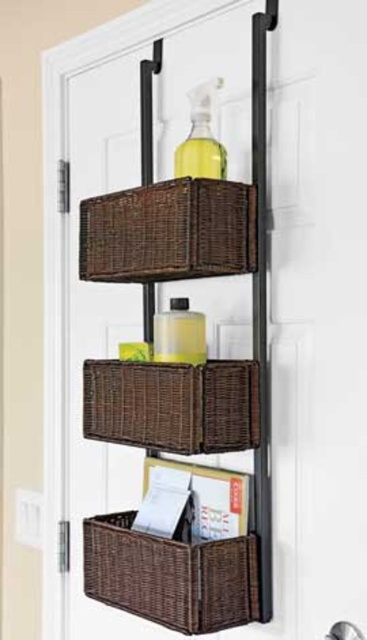
You are standing in front of the storage rack and want to reach the point at coordinates point (252, 604). If your arm can extend 1.5 meters, can you reach that point?

The distance between point (252, 604) and the viewer is 1.44 meters, so yes, your arm can reach it since it extends further than that.

You are organizing your over the door storage rack and notice two brown baskets at the center. Which basket is closer to you, the brown wicker basket at center or the woven brown basket at center?

The brown wicker basket at center is closer to you because it is in front of the woven brown basket at center.

You are organizing your over the door storage rack and need to place a new item. The item is 15 cm in height. Which basket can it fit into, the brown wicker basket at center or the woven brown basket at lower center?

The woven brown basket at lower center is shorter than the brown wicker basket at center. Since the item is 15 cm tall, it can fit into either basket. However, if the item needs to be placed in the lower basket, it will fit as the item is shorter than the basket height.